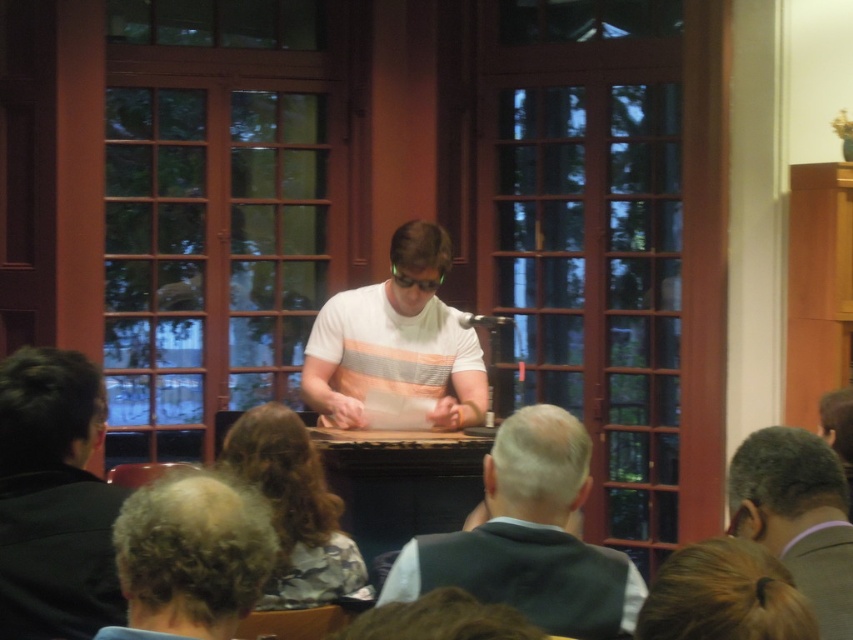
Looking at this image, does white striped shirt at center appear on the right side of blonde hair at lower right?

No, white striped shirt at center is not to the right of blonde hair at lower right.

Locate an element on the screen. Image resolution: width=853 pixels, height=640 pixels. white striped shirt at center is located at coordinates (396, 340).

Locate an element on the screen. This screenshot has width=853, height=640. curly hair at lower left is located at coordinates (190, 556).

Measure the distance between curly hair at lower left and gray suit at lower right.

They are 1.19 meters apart.

This screenshot has width=853, height=640. Identify the location of curly hair at lower left. click(x=190, y=556).

Based on the photo, can you confirm if gray wool vest at center is bigger than white striped shirt at center?

No, gray wool vest at center is not bigger than white striped shirt at center.

Image resolution: width=853 pixels, height=640 pixels. In order to click on gray wool vest at center in this screenshot , I will do (531, 538).